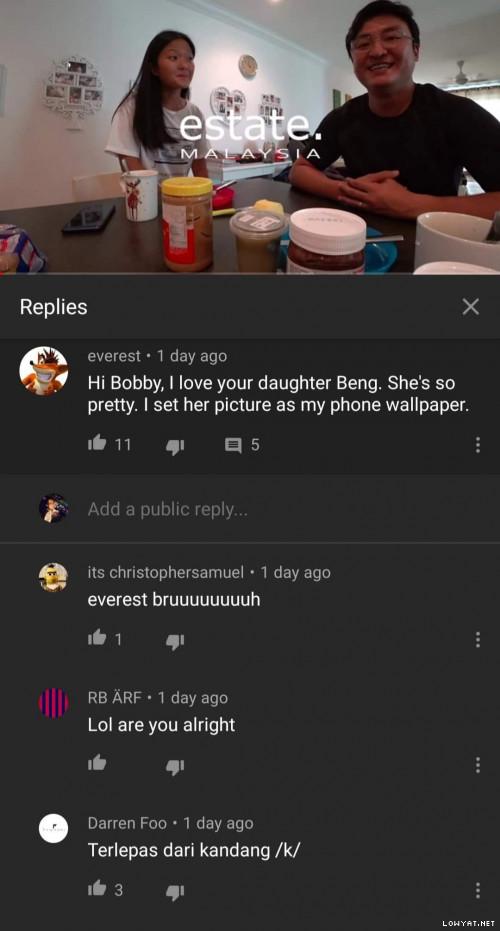
You are a GUI agent. You are given a task and a screenshot of the screen. Output one action in this format:
    pyautogui.click(x=<x>, y=<y>)
    Task: Click on the bowl
    This screenshot has height=931, width=500.
    Given the screenshot: What is the action you would take?
    pyautogui.click(x=439, y=232)